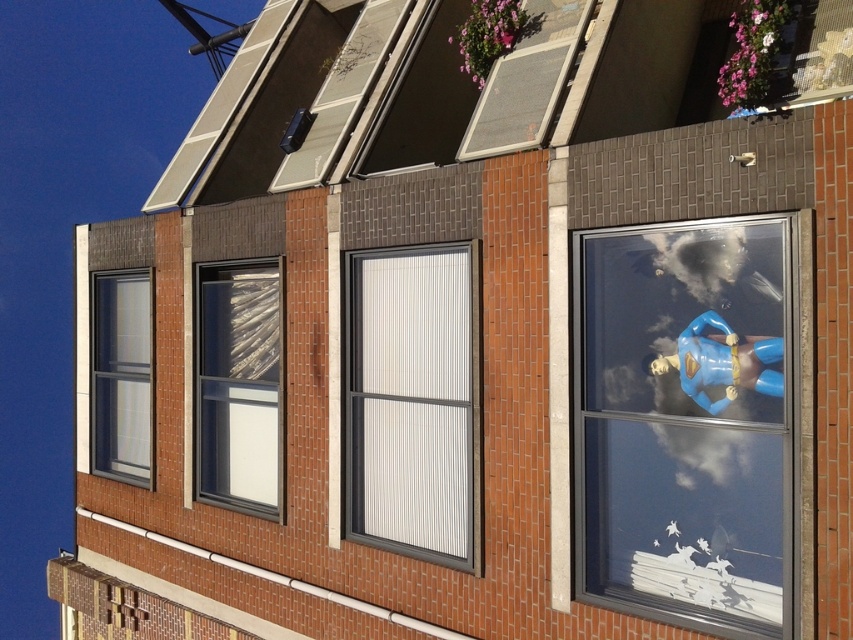
Question: Can you confirm if white textured blinds at center is wider than clear glass window at upper left?

Choices:
 (A) no
 (B) yes

Answer: (B)

Question: Which of the following is the closest to the observer?

Choices:
 (A) (572, 35)
 (B) (657, 365)
 (C) (113, 419)
 (D) (200, 388)

Answer: (B)

Question: Can you confirm if white textured blinds at center is wider than transparent glass window at center?

Choices:
 (A) yes
 (B) no

Answer: (A)

Question: Among these points, which one is nearest to the camera?

Choices:
 (A) click(99, 432)
 (B) click(244, 480)

Answer: (B)

Question: Can you confirm if white textured blinds at center is smaller than blue plastic superman figure at right?

Choices:
 (A) yes
 (B) no

Answer: (B)

Question: Considering the real-world distances, which object is closest to the matte gray window at upper center?

Choices:
 (A) blue plastic superman figure at right
 (B) white textured blinds at center
 (C) clear glass window at upper left

Answer: (B)